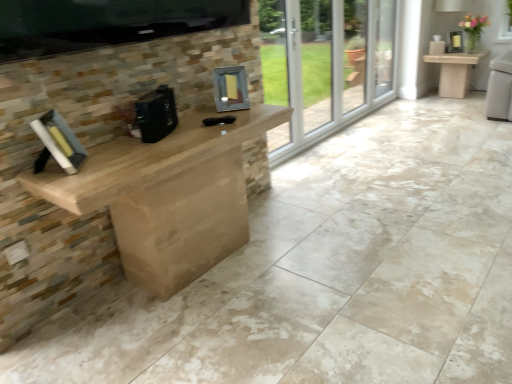
Question: Considering the positions of hardcover book at left and matte stone table at right in the image, is hardcover book at left taller or shorter than matte stone table at right?

Choices:
 (A) short
 (B) tall

Answer: (A)

Question: Based on their sizes in the image, would you say hardcover book at left is bigger or smaller than matte stone table at right?

Choices:
 (A) big
 (B) small

Answer: (B)

Question: Considering the real-world distances, which object is farthest from the matte stone table at right?

Choices:
 (A) metallic silver frame at center, which is the second appliance in left-to-right order
 (B) black matte coffee machine at center, which is the 1th appliance from left to right
 (C) hardcover book at left

Answer: (C)

Question: Based on their relative distances, which object is nearer to the matte stone table at right?

Choices:
 (A) metallic silver frame at center, acting as the 1th appliance starting from the right
 (B) black matte coffee machine at center, positioned as the first appliance in front-to-back order
 (C) hardcover book at left

Answer: (A)